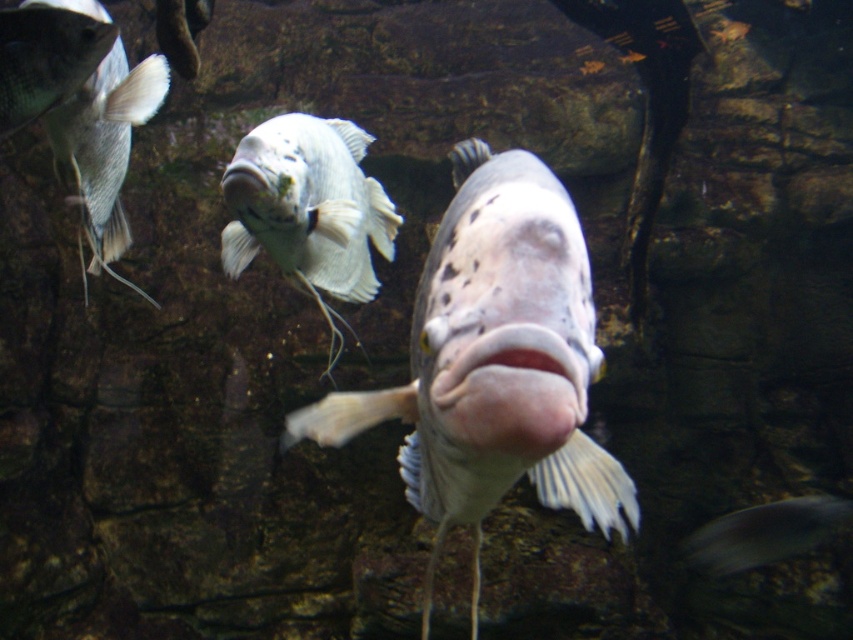
Does speckled white fish at center appear on the right side of matte white fish at upper left?

Indeed, speckled white fish at center is positioned on the right side of matte white fish at upper left.

Between point (471, 195) and point (114, 218), which one is positioned behind?

The point (114, 218) is behind.

The image size is (853, 640). What do you see at coordinates (492, 364) in the screenshot?
I see `speckled white fish at center` at bounding box center [492, 364].

Find the location of `speckled white fish at center`. speckled white fish at center is located at coordinates (492, 364).

This screenshot has height=640, width=853. I want to click on matte white fish at upper left, so click(x=105, y=147).

Who is positioned more to the left, matte white fish at upper left or silvery metallic fish at lower right?

matte white fish at upper left

The height and width of the screenshot is (640, 853). What do you see at coordinates (105, 147) in the screenshot? I see `matte white fish at upper left` at bounding box center [105, 147].

Identify the location of matte white fish at upper left. (105, 147).

Based on the photo, does shiny blue fish at upper left have a greater height compared to silvery metallic fish at lower right?

No, shiny blue fish at upper left is not taller than silvery metallic fish at lower right.

Does point (62, 74) lie in front of point (833, 522)?

Yes, it is.

Where is `shiny blue fish at upper left`? shiny blue fish at upper left is located at coordinates (45, 60).